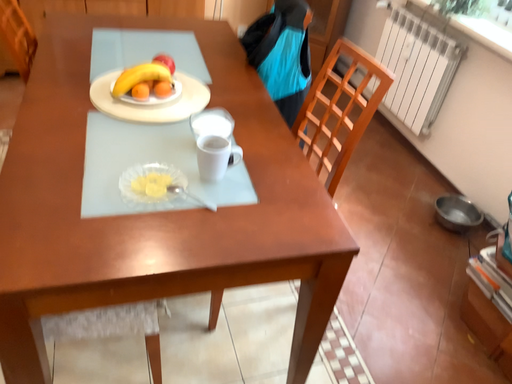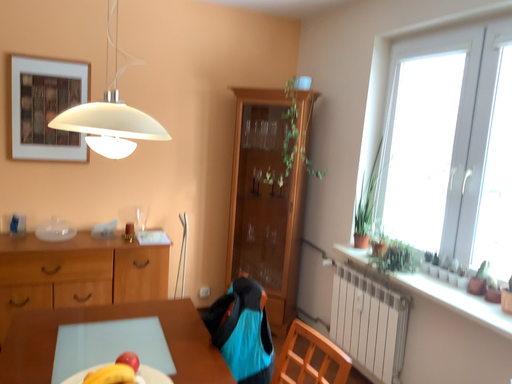
Question: How did the camera likely rotate when shooting the video?

Choices:
 (A) rotated downward
 (B) rotated upward

Answer: (B)